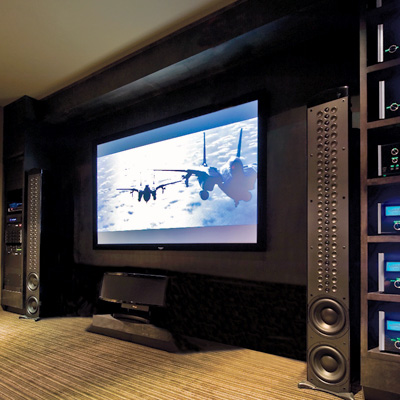
Locate an element on the screen. woodgrain is located at coordinates (82, 380).